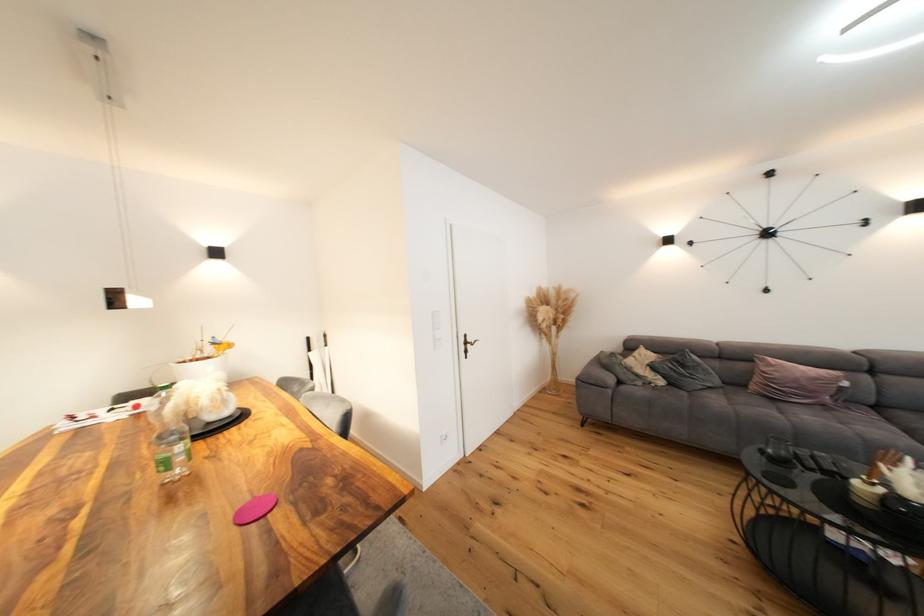
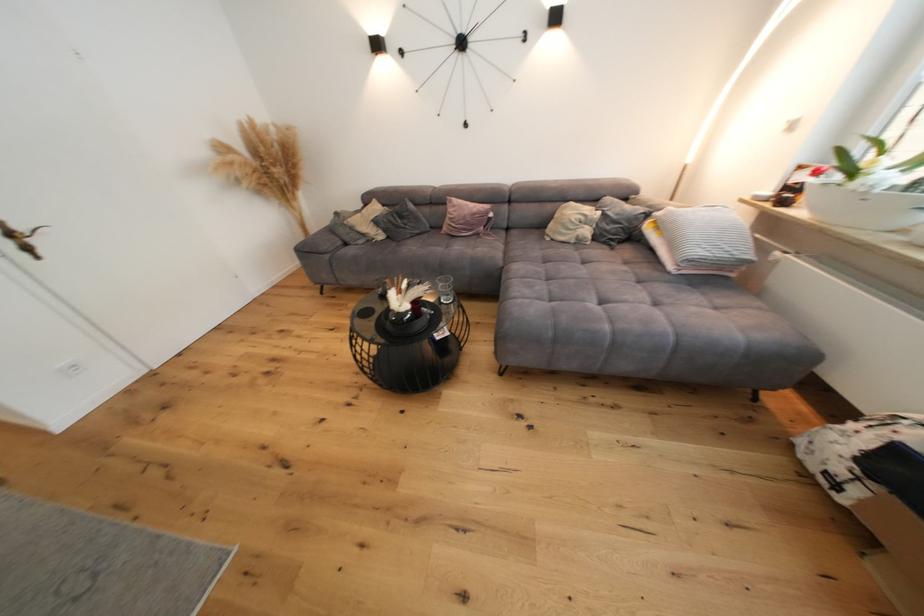
The point at (x=690, y=368) is marked in the first image. Where is the corresponding point in the second image?

(408, 219)